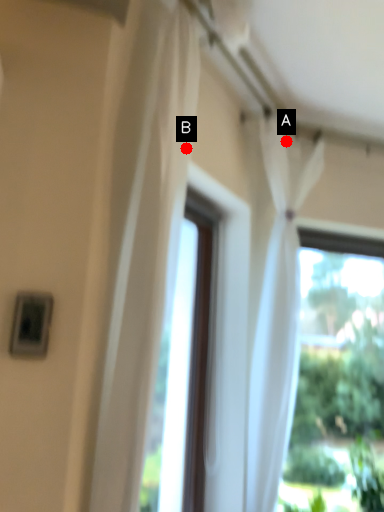
Question: Two points are circled on the image, labeled by A and B beside each circle. Which of the following is the closest to the observer?

Choices:
 (A) A is closer
 (B) B is closer

Answer: (B)